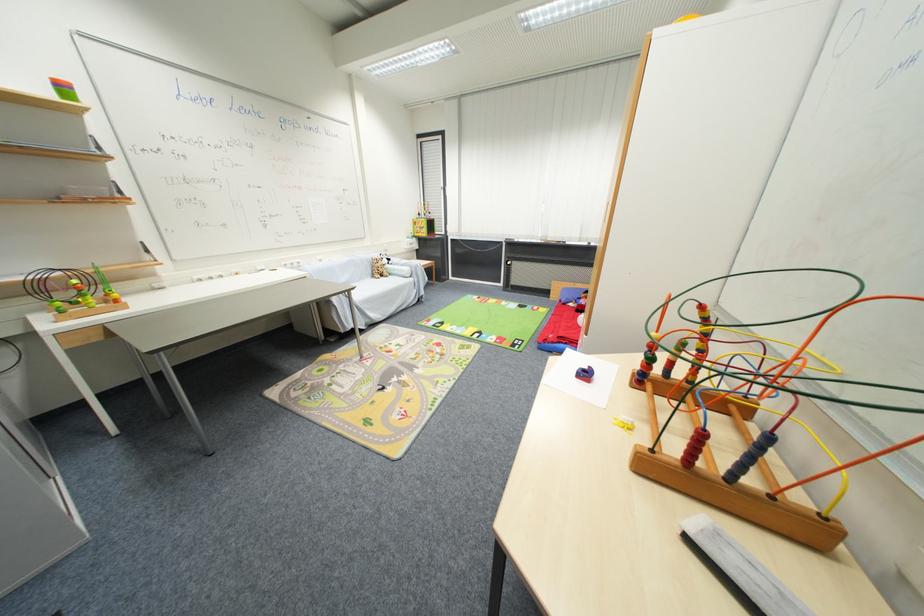
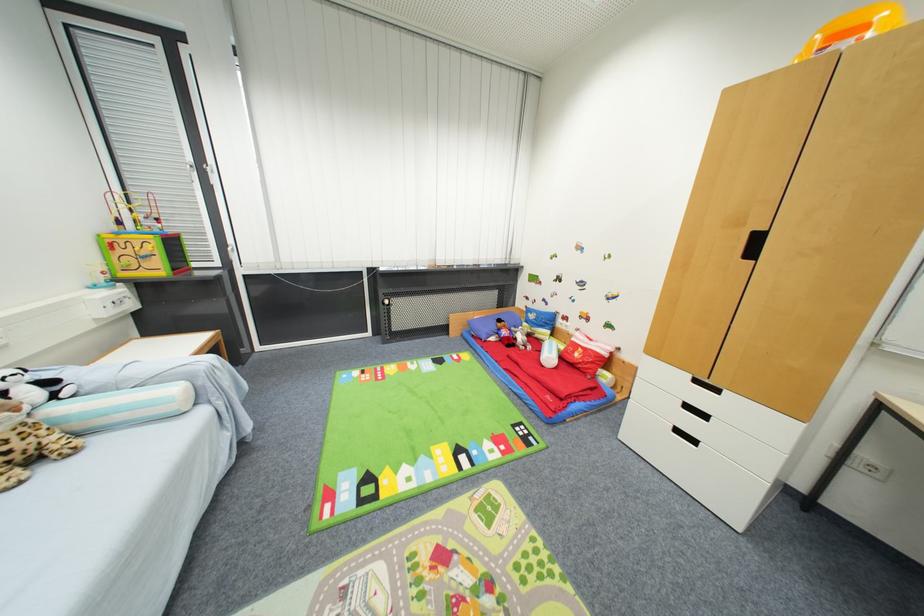
Find the pixel in the second image that matches point (393, 268) in the first image.

(64, 411)